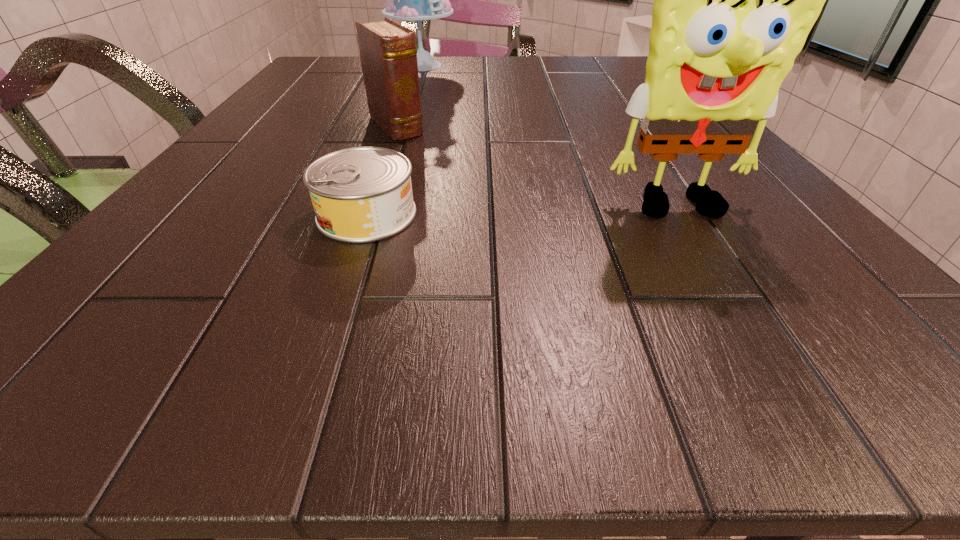
Identify the location of vacant region located on the spine side of the third tallest object. Image resolution: width=960 pixels, height=540 pixels. (441, 171).

Identify the location of vacant space located 0.300m on the spine side of the third tallest object. (491, 217).

In order to click on free space located 0.150m with a ladder on the side of the tallest object in this screenshot , I will do `click(434, 96)`.

Find the location of a particular element. free location located 0.300m with a ladder on the side of the tallest object is located at coordinates (444, 122).

Locate an element on the screen. The image size is (960, 540). free space located with a ladder on the side of the tallest object is located at coordinates (448, 136).

Locate an element on the screen. object at the far edge is located at coordinates (417, 0).

Identify the location of object present at the right edge. The height and width of the screenshot is (540, 960). (734, 0).

Locate an element on the screen. The width and height of the screenshot is (960, 540). free spot at the far edge of the desktop is located at coordinates (588, 80).

Identify the location of vacant space at the near edge of the desktop. The height and width of the screenshot is (540, 960). (493, 283).

Identify the location of free space at the left edge of the desktop. (193, 235).